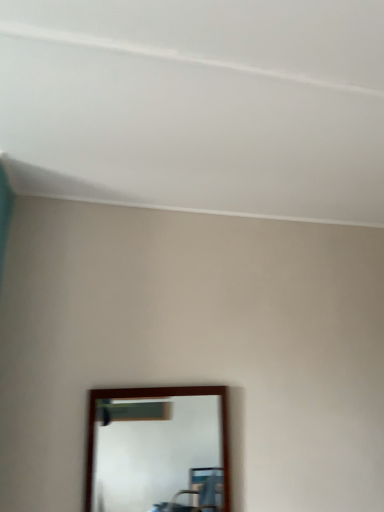
This screenshot has height=512, width=384. I want to click on brown wooden mirror at lower center, so click(x=158, y=450).

This screenshot has height=512, width=384. Describe the element at coordinates (158, 450) in the screenshot. I see `brown wooden mirror at lower center` at that location.

The height and width of the screenshot is (512, 384). Find the location of `brown wooden mirror at lower center`. brown wooden mirror at lower center is located at coordinates (158, 450).